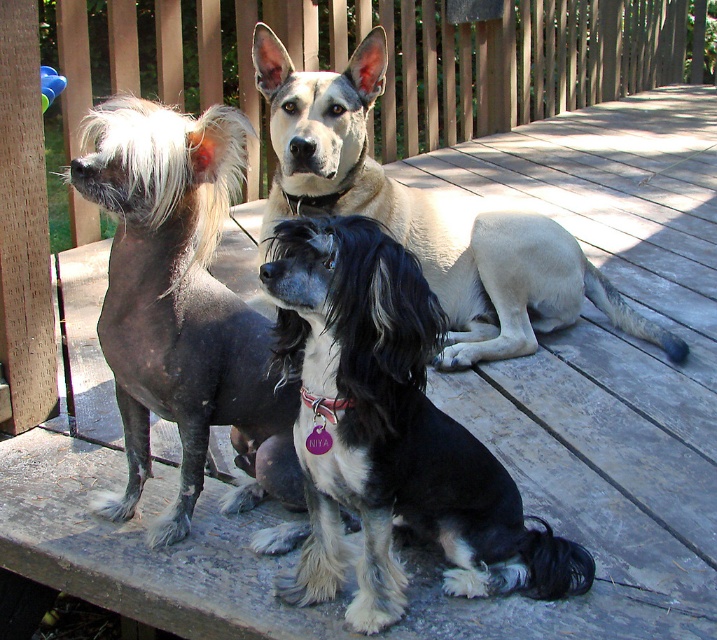
Question: Is black silky dog at center to the right of light beige fur at center from the viewer's perspective?

Choices:
 (A) yes
 (B) no

Answer: (B)

Question: Does black silky dog at center appear under light beige fur at center?

Choices:
 (A) no
 (B) yes

Answer: (B)

Question: Which object is closer to the camera taking this photo?

Choices:
 (A) light beige fur at center
 (B) black silky dog at center
 (C) shiny black fur at center

Answer: (B)

Question: Among these objects, which one is farthest from the camera?

Choices:
 (A) shiny black fur at center
 (B) light beige fur at center
 (C) black silky dog at center

Answer: (B)

Question: Which object is closer to the camera taking this photo?

Choices:
 (A) shiny black fur at center
 (B) light beige fur at center

Answer: (A)

Question: Is black silky dog at center positioned behind light beige fur at center?

Choices:
 (A) no
 (B) yes

Answer: (A)